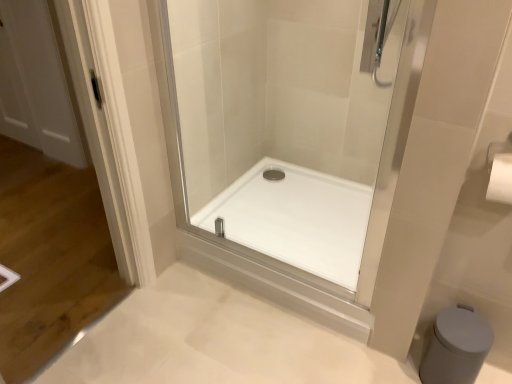
Find the location of `vacant space situated above white matte bidet at lower right (from a real-world perspective)`. vacant space situated above white matte bidet at lower right (from a real-world perspective) is located at coordinates (459, 326).